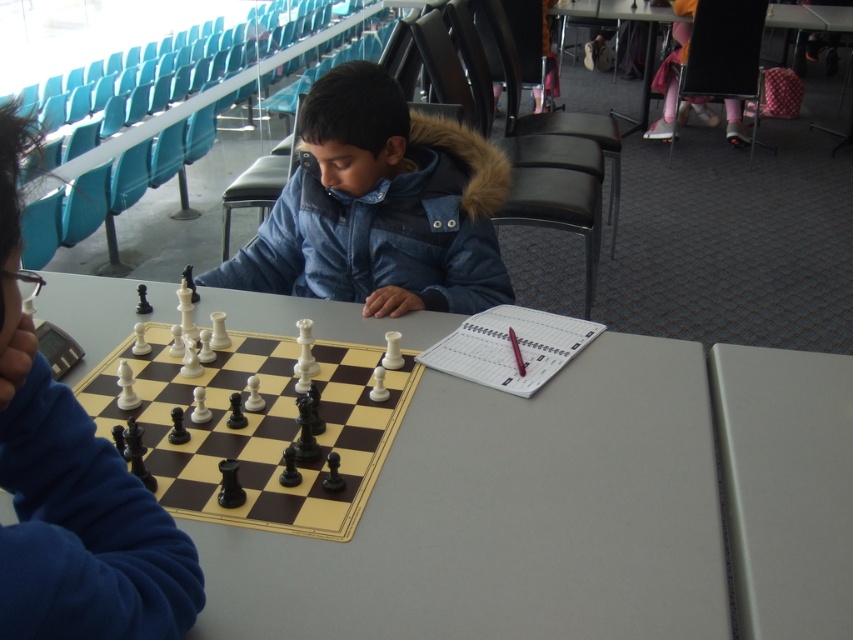
Between smooth plastic table at center and denim jacket at center, which one appears on the right side from the viewer's perspective?

Positioned to the right is denim jacket at center.

Describe the element at coordinates (509, 516) in the screenshot. I see `smooth plastic table at center` at that location.

Measure the distance between point [668,432] and camera.

A distance of 1.32 meters exists between point [668,432] and camera.

Locate an element on the screen. The image size is (853, 640). smooth plastic table at center is located at coordinates (509, 516).

Does smooth plastic table at center appear on the right side of white plastic chessboard at center?

Answer: Correct, you'll find smooth plastic table at center to the right of white plastic chessboard at center.

Is smooth plastic table at center to the left of white plastic chessboard at center from the viewer's perspective?

In fact, smooth plastic table at center is to the right of white plastic chessboard at center.

Which is behind, point (296, 304) or point (221, 516)?

Positioned behind is point (296, 304).

The height and width of the screenshot is (640, 853). I want to click on smooth plastic table at center, so click(x=509, y=516).

Can you confirm if white plastic chessboard at center is taller than white matte table at center?

Incorrect, white plastic chessboard at center's height is not larger of white matte table at center's.

How distant is white plastic chessboard at center from white matte table at center?

29.61 inches

Which is behind, point (166, 432) or point (775, 557)?

Positioned behind is point (166, 432).

You are a GUI agent. You are given a task and a screenshot of the screen. Output one action in this format:
    pyautogui.click(x=<x>, y=<y>)
    Task: Click on the white plastic chessboard at center
    The height and width of the screenshot is (640, 853).
    Given the screenshot: What is the action you would take?
    pyautogui.click(x=257, y=428)